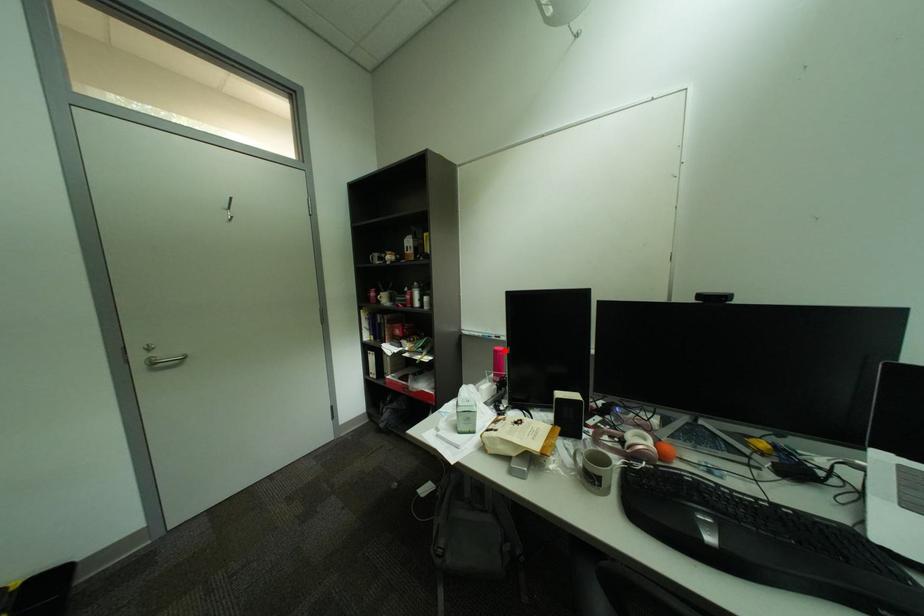
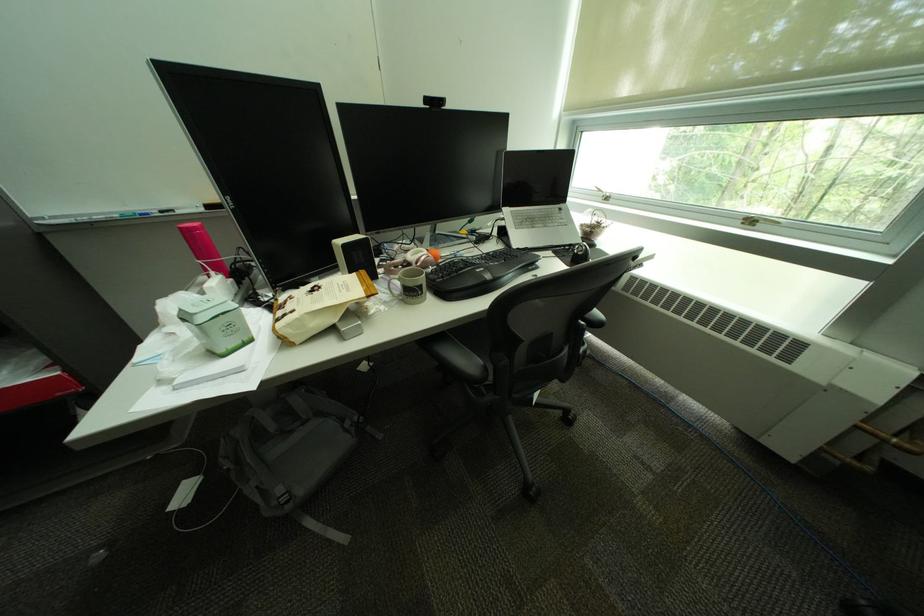
Find the pixel in the second image that matches the highlighted location in the first image.

(190, 230)